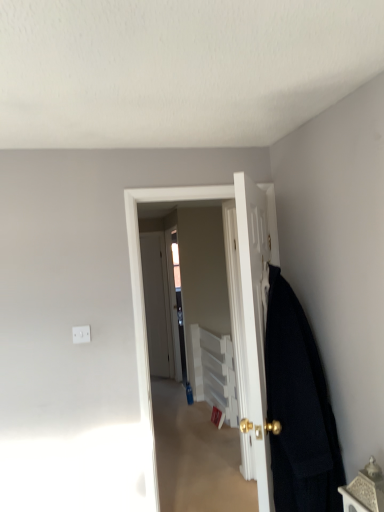
Question: Is white plastic cabinet at center looking in the opposite direction of dark woolen blanket at right?

Choices:
 (A) no
 (B) yes

Answer: (A)

Question: Considering the relative sizes of white plastic cabinet at center and dark woolen blanket at right in the image provided, is white plastic cabinet at center bigger than dark woolen blanket at right?

Choices:
 (A) no
 (B) yes

Answer: (B)

Question: From a real-world perspective, is white plastic cabinet at center located beneath dark woolen blanket at right?

Choices:
 (A) no
 (B) yes

Answer: (B)

Question: Considering the relative sizes of white plastic cabinet at center and dark woolen blanket at right in the image provided, is white plastic cabinet at center shorter than dark woolen blanket at right?

Choices:
 (A) yes
 (B) no

Answer: (A)

Question: Considering the relative sizes of white plastic cabinet at center and dark woolen blanket at right in the image provided, is white plastic cabinet at center taller than dark woolen blanket at right?

Choices:
 (A) yes
 (B) no

Answer: (B)

Question: Is white plastic cabinet at center surrounding dark woolen blanket at right?

Choices:
 (A) yes
 (B) no

Answer: (B)

Question: Can you confirm if clear glass screen door at center is smaller than metallic textured box at lower right?

Choices:
 (A) no
 (B) yes

Answer: (A)

Question: From the image's perspective, is clear glass screen door at center on metallic textured box at lower right?

Choices:
 (A) no
 (B) yes

Answer: (B)

Question: Can you confirm if clear glass screen door at center is shorter than metallic textured box at lower right?

Choices:
 (A) yes
 (B) no

Answer: (B)

Question: Can you confirm if clear glass screen door at center is taller than metallic textured box at lower right?

Choices:
 (A) no
 (B) yes

Answer: (B)

Question: Could you tell me if clear glass screen door at center is facing metallic textured box at lower right?

Choices:
 (A) yes
 (B) no

Answer: (B)

Question: From a real-world perspective, is clear glass screen door at center physically below metallic textured box at lower right?

Choices:
 (A) yes
 (B) no

Answer: (B)

Question: Can you see dark woolen blanket at right touching white plastic cabinet at center?

Choices:
 (A) no
 (B) yes

Answer: (A)